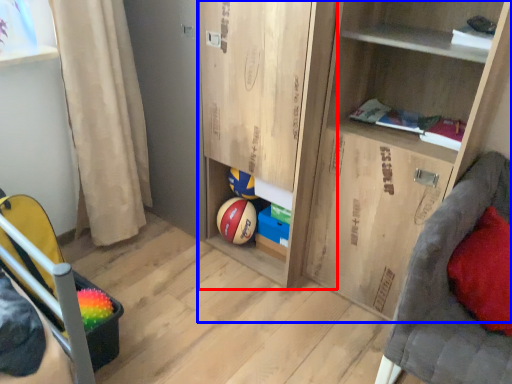
Question: Which object is further to the camera taking this photo, cabinet (highlighted by a red box) or cupboard (highlighted by a blue box)?

Choices:
 (A) cabinet
 (B) cupboard

Answer: (A)